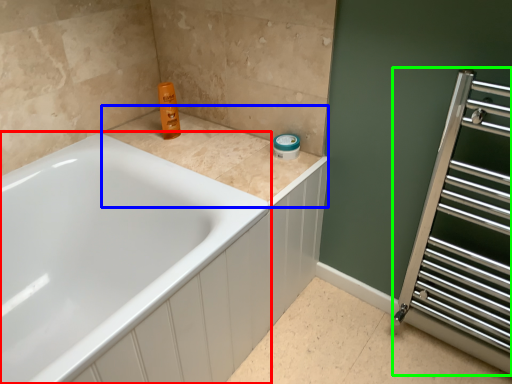
Question: Based on their relative distances, which object is farther from bathtub (highlighted by a red box)? Choose from counter top (highlighted by a blue box) and screen door (highlighted by a green box).

Choices:
 (A) counter top
 (B) screen door

Answer: (B)